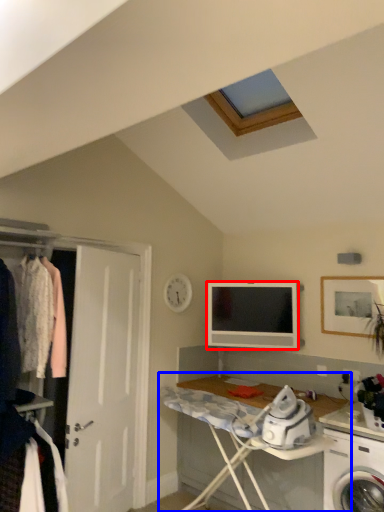
Question: Which object appears closest to the camera in this image, television (highlighted by a red box) or desk (highlighted by a blue box)?

Choices:
 (A) television
 (B) desk

Answer: (B)